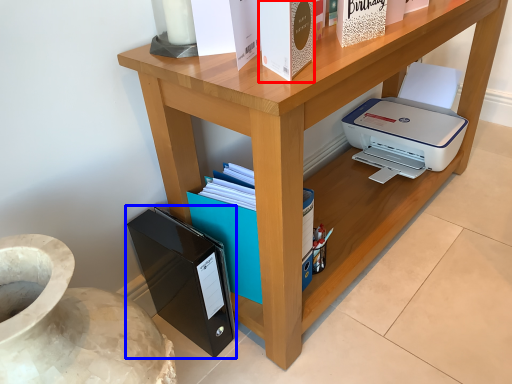
Question: Which object is closer to the camera taking this photo, paperback book (highlighted by a red box) or paperback book (highlighted by a blue box)?

Choices:
 (A) paperback book
 (B) paperback book

Answer: (A)